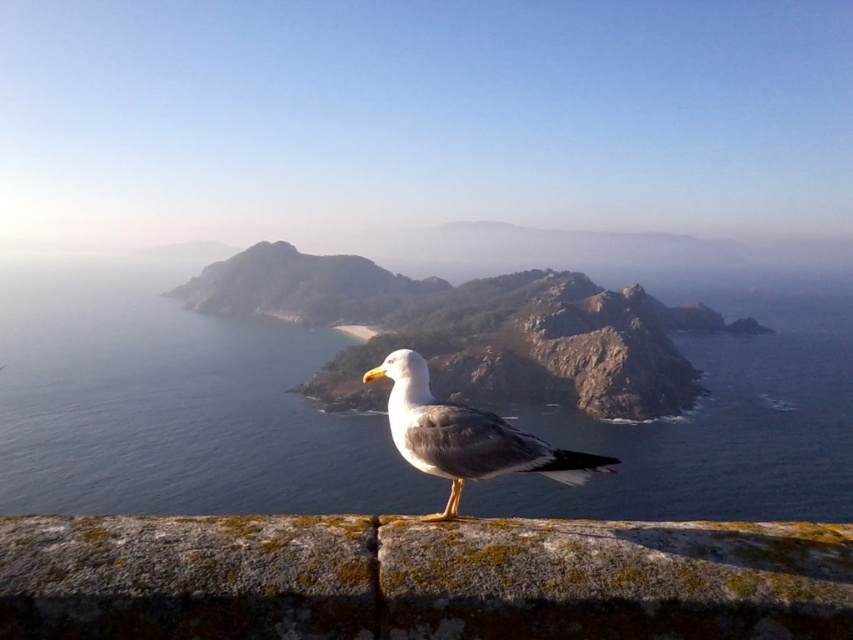
Question: Which object appears farthest from the camera in this image?

Choices:
 (A) blue water at center
 (B) mossy stone at center
 (C) gray feathered seagull at center

Answer: (A)

Question: Which point is closer to the camera taking this photo?

Choices:
 (A) (9, 387)
 (B) (581, 456)
 (C) (503, 550)

Answer: (C)

Question: Does blue water at center have a lesser width compared to mossy stone at center?

Choices:
 (A) no
 (B) yes

Answer: (A)

Question: Which of the following is the closest to the observer?

Choices:
 (A) mossy stone at center
 (B) blue water at center

Answer: (A)

Question: Can you confirm if blue water at center is positioned above gray feathered seagull at center?

Choices:
 (A) yes
 (B) no

Answer: (A)

Question: Considering the relative positions of mossy stone at center and gray feathered seagull at center in the image provided, where is mossy stone at center located with respect to gray feathered seagull at center?

Choices:
 (A) below
 (B) above

Answer: (B)